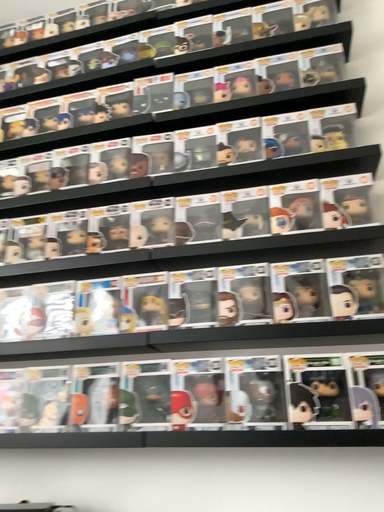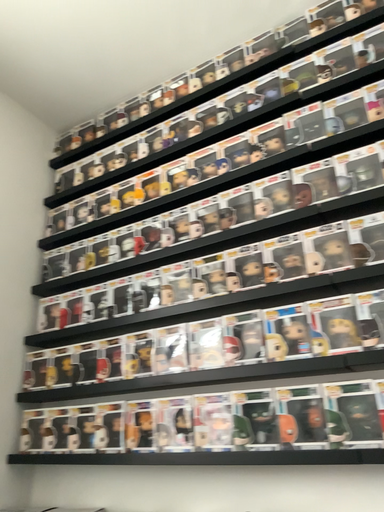
Question: How did the camera likely rotate when shooting the video?

Choices:
 (A) rotated right
 (B) rotated left

Answer: (B)